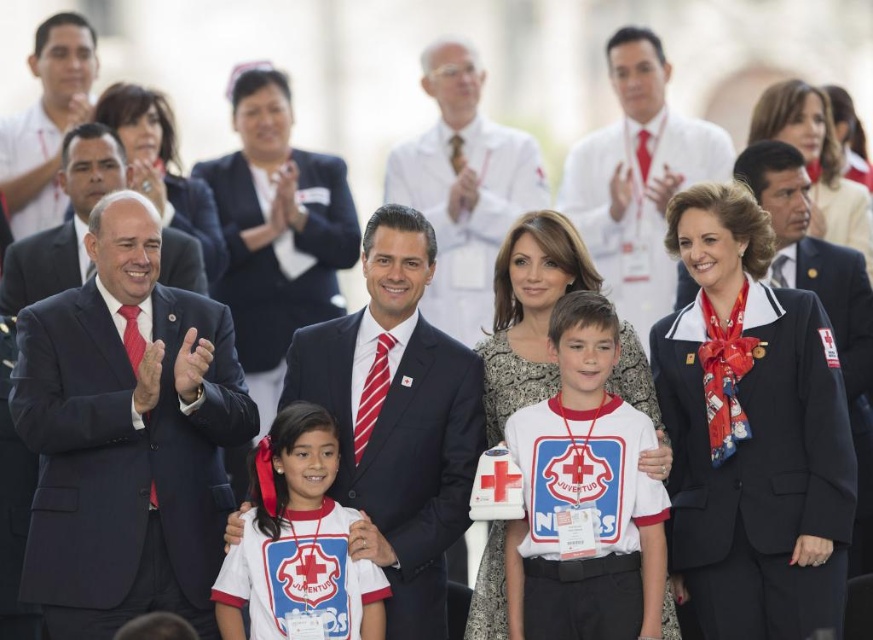
You are a photographer at the event and need to ensure that both the matte black suit at left and the white jersey at center are visible in the photo. Given their height difference, which one might you need to adjust the camera angle for to include fully in the frame?

The matte black suit at left is much taller than the white jersey at center, so you should lower the camera angle to capture the full height of the matte black suit at left while still including the white jersey at center in the frame.

Based on the photo, you are a photographer trying to capture a group photo of the matte black suit at left and the matte black suit at center. Which one should you focus on first if you want to start from the left side?

The matte black suit at left should be focused on first since it is positioned on the left side of the matte black suit at center.

You are a photographer trying to arrange the matte black suit at left and the matte black suit at center for a group photo. Which of the two should you move closer to the camera to make them appear the same size?

To make the matte black suit at left and the matte black suit at center appear the same size, you should move the matte black suit at left closer to the camera since it is smaller than the matte black suit at center.